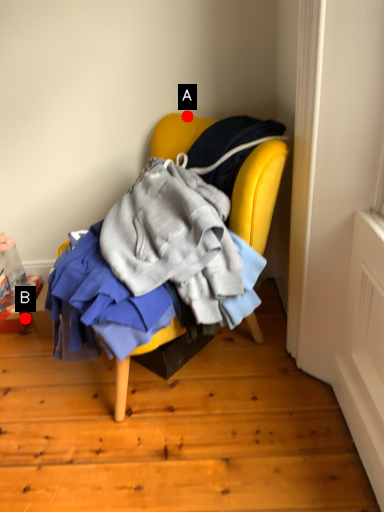
Question: Two points are circled on the image, labeled by A and B beside each circle. Which point is farther from the camera taking this photo?

Choices:
 (A) A is further
 (B) B is further

Answer: (B)